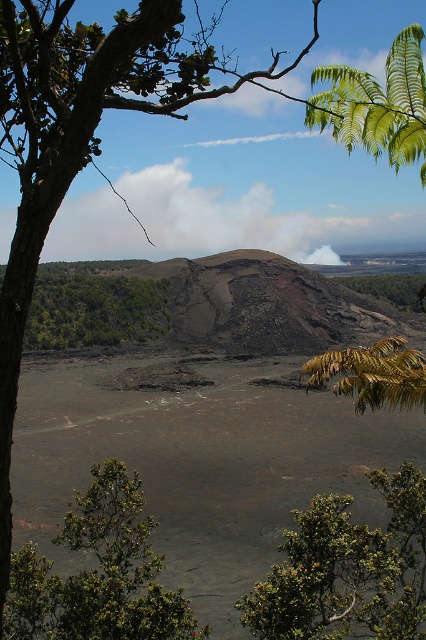
You are standing at the origin point of the coordinate system in the volcanic landscape. The green leafy tree at lower left is located at coordinate point 0.898, 0.232. If you want to reach the tree, in which direction should you move?

To reach the green leafy tree at lower left located at coordinate point (98,573), you should move towards the lower left direction since the coordinates indicate it is positioned in that direction from the origin.

You are hiking in this volcanic area and want to reach the green leafy tree at center. Which direction should you move relative to the green leafy tree at lower left to get closer to your destination?

You should move away from the green leafy tree at lower left because the green leafy tree at center is farther from you than the green leafy tree at lower left, so moving away from the closer tree would bring you closer to the farther one.

What is the 2D coordinate of the green leafy tree at lower left in the volcanic landscape image?

Result: The 2D coordinate of the green leafy tree at lower left is at point (98, 573).